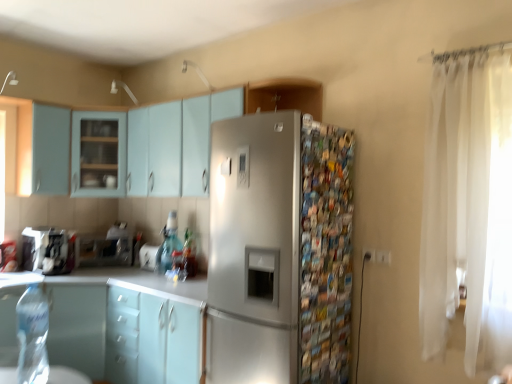
Question: Considering the positions of point (59, 130) and point (131, 319), is point (59, 130) closer or farther from the camera than point (131, 319)?

Choices:
 (A) closer
 (B) farther

Answer: (B)

Question: In terms of size, does light blue matte cabinet at upper left, which appears as the sixth cabinetry when ordered from the bottom, appear bigger or smaller than matte white cabinet at lower left, placed as the sixth cabinetry when sorted from top to bottom?

Choices:
 (A) small
 (B) big

Answer: (A)

Question: Which object is the farthest from the white sheer curtain at right?

Choices:
 (A) teal glass bottle at center
 (B) brushed metal coffee maker at left, which is the 1th appliance in left-to-right order
 (C) light blue matte cabinet at upper center, the 5th cabinetry viewed from the top
 (D) light blue matte cabinet at center, which ranks as the 7th cabinetry in top-to-bottom order
 (E) satin silver microwave at center, which ranks as the second appliance in right-to-left order

Answer: (B)

Question: Considering the real-world distances, which object is farthest from the light blue matte cabinet at upper center, the 5th cabinetry viewed from the top?

Choices:
 (A) satin finish cabinet at upper center, the seventh cabinetry in the bottom-to-top sequence
 (B) light blue matte cabinet at center, the 1th cabinetry in the bottom-to-top sequence
 (C) brushed metal coffee maker at left, which is the 1th appliance in left-to-right order
 (D) matte white cabinet at lower left, placed as the sixth cabinetry when sorted from top to bottom
 (E) translucent glass bottle at center, the 3th bottle in the left-to-right sequence

Answer: (C)